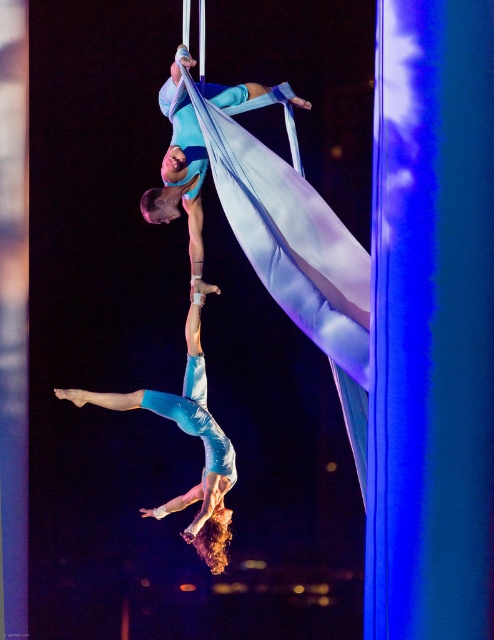
Question: Is light blue fabric at center bigger than matte blue fabric at upper center?

Choices:
 (A) yes
 (B) no

Answer: (B)

Question: Does light blue fabric at center have a greater width compared to matte blue fabric at upper center?

Choices:
 (A) no
 (B) yes

Answer: (B)

Question: Which point is closer to the camera?

Choices:
 (A) (204, 163)
 (B) (197, 355)

Answer: (A)

Question: Can you confirm if light blue fabric at center is positioned above matte blue fabric at upper center?

Choices:
 (A) yes
 (B) no

Answer: (B)